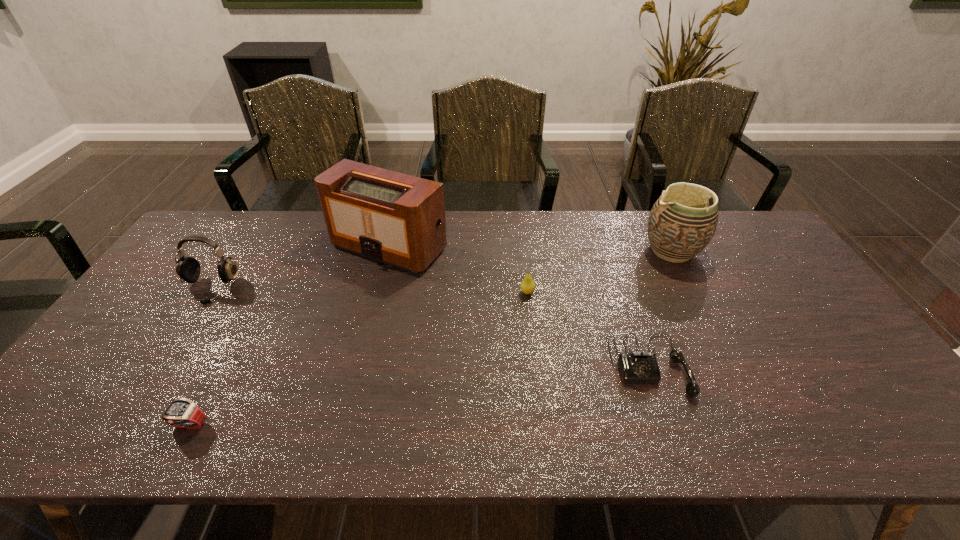
You are a GUI agent. You are given a task and a screenshot of the screen. Output one action in this format:
    pyautogui.click(x=<x>, y=<y>)
    Task: Click on the free space located 0.150m on the right of the third object from left to right
    This screenshot has height=540, width=960.
    Given the screenshot: What is the action you would take?
    pyautogui.click(x=493, y=246)

Find the location of a particular element. The height and width of the screenshot is (540, 960). free space located on the front of the rightmost object is located at coordinates (696, 298).

Where is `vacant region located with the microphone on the side of the leftmost object`? vacant region located with the microphone on the side of the leftmost object is located at coordinates (151, 380).

Image resolution: width=960 pixels, height=540 pixels. What are the coordinates of `free space located on the right of the pear` in the screenshot? It's located at (562, 293).

Locate an element on the screen. free space located 0.150m on the back of the nearest object is located at coordinates (225, 361).

At what (x,y) coordinates should I click in order to perform the action: click on radio receiver that is at the far edge. Please return your answer as a coordinate pair (x, y). Looking at the image, I should click on (394, 218).

The height and width of the screenshot is (540, 960). Find the location of `pottery that is positioned at the far edge`. pottery that is positioned at the far edge is located at coordinates (681, 224).

This screenshot has height=540, width=960. I want to click on object located at the near edge, so click(182, 413).

Where is `object present at the left edge`? The width and height of the screenshot is (960, 540). object present at the left edge is located at coordinates (188, 268).

Find the location of a particular element. This screenshot has width=960, height=540. free region at the far edge is located at coordinates (569, 223).